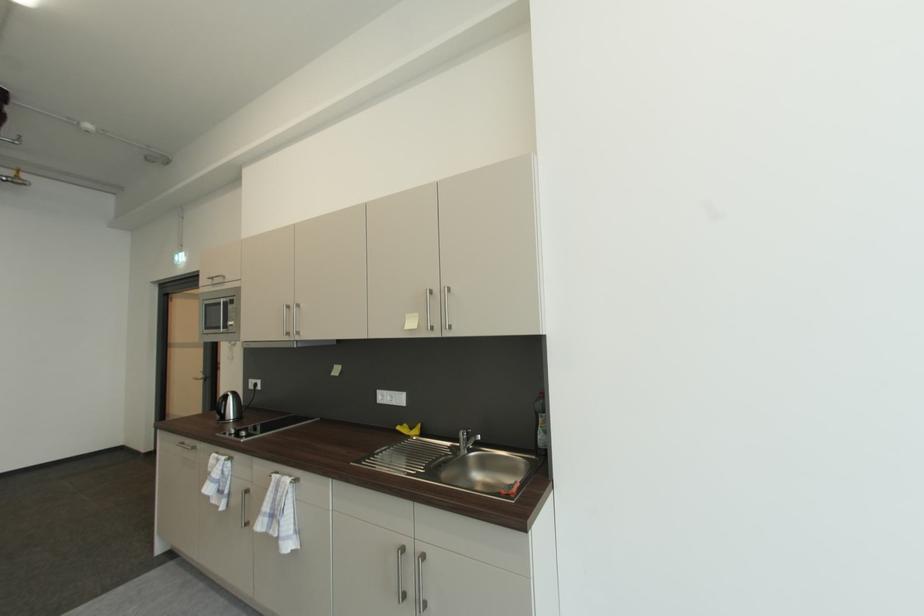
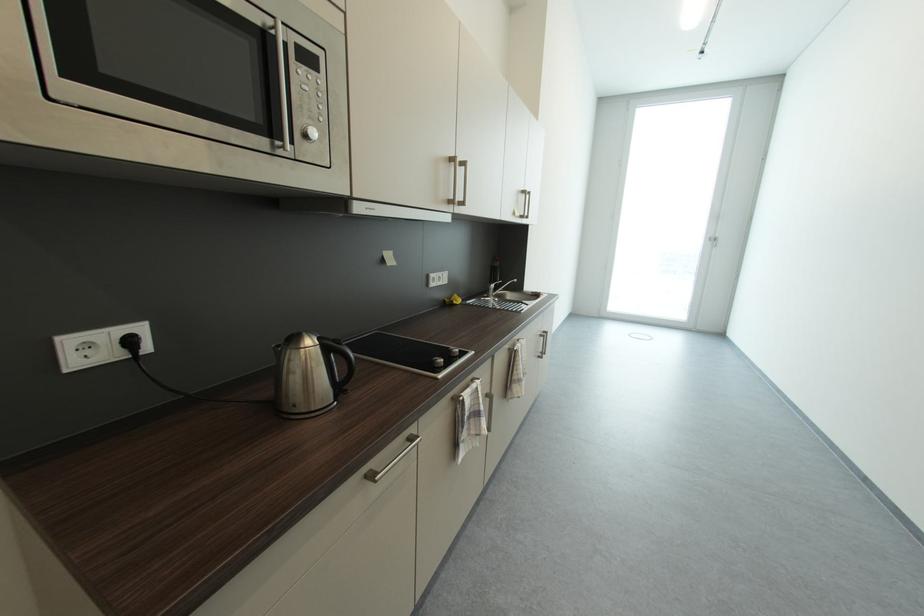
Locate, in the second image, the point that corresponds to the point at 408,427 in the first image.

(453, 302)